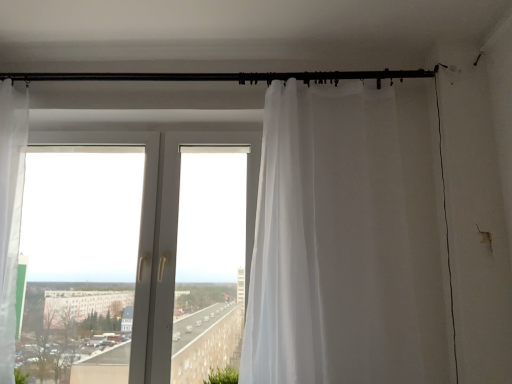
The width and height of the screenshot is (512, 384). In order to click on green leafy plant at lower left in this screenshot , I will do `click(21, 376)`.

Where is `transparent plastic window at center`? The image size is (512, 384). transparent plastic window at center is located at coordinates (159, 214).

From a real-world perspective, is black metal rod at upper center on top of transparent plastic window at center?

Yes.

Locate an element on the screen. The width and height of the screenshot is (512, 384). window that is in front of the black metal rod at upper center is located at coordinates (159, 214).

Does black metal rod at upper center appear on the right side of transparent plastic window at center?

Correct, you'll find black metal rod at upper center to the right of transparent plastic window at center.

Does point (105, 80) appear closer or farther from the camera than point (152, 221)?

Point (105, 80) appears to be farther away from the viewer than point (152, 221).

Considering the relative positions of sheer white curtain at right and transparent plastic window at center in the image provided, is sheer white curtain at right behind transparent plastic window at center?

No, sheer white curtain at right is closer to the viewer.

Does point (356, 269) appear closer or farther from the camera than point (148, 150)?

Point (356, 269) is positioned closer to the camera compared to point (148, 150).

Between sheer white curtain at right and transparent plastic window at center, which one has larger width?

sheer white curtain at right is wider.

The width and height of the screenshot is (512, 384). What are the coordinates of `window behind the sheer white curtain at right` in the screenshot? It's located at (159, 214).

From the image's perspective, would you say black metal rod at upper center is shown under green leafy plant at lower left?

No, from the image's perspective, black metal rod at upper center is not below green leafy plant at lower left.

In the scene shown: Can you tell me how much black metal rod at upper center and green leafy plant at lower left differ in facing direction?

There is a 0.255-degree angle between the facing directions of black metal rod at upper center and green leafy plant at lower left.

Is black metal rod at upper center touching green leafy plant at lower left?

No, black metal rod at upper center is not beside green leafy plant at lower left.

Can you confirm if black metal rod at upper center is positioned to the left of green leafy plant at lower left?

Incorrect, black metal rod at upper center is not on the left side of green leafy plant at lower left.

Identify the location of window behind the green leafy plant at lower left. Image resolution: width=512 pixels, height=384 pixels. (159, 214).

Considering the sizes of transparent plastic window at center and green leafy plant at lower left in the image, is transparent plastic window at center bigger or smaller than green leafy plant at lower left?

Considering their sizes, transparent plastic window at center takes up more space than green leafy plant at lower left.

From the image's perspective, does transparent plastic window at center appear higher than green leafy plant at lower left?

Yes.

Is green leafy plant at lower left at the back of transparent plastic window at center?

No, transparent plastic window at center is not facing away from green leafy plant at lower left.

Can you tell me how much transparent plastic window at center and sheer white curtain at right differ in facing direction?

0.876 degrees separate the facing orientations of transparent plastic window at center and sheer white curtain at right.

In the image, is transparent plastic window at center positioned in front of or behind sheer white curtain at right?

In the image, transparent plastic window at center appears behind sheer white curtain at right.

Looking at this image, does transparent plastic window at center contain sheer white curtain at right?

No, transparent plastic window at center does not contain sheer white curtain at right.

Is the surface of transparent plastic window at center in direct contact with sheer white curtain at right?

No, transparent plastic window at center is not touching sheer white curtain at right.

Can you confirm if black metal rod at upper center is positioned to the left of sheer white curtain at right?

Indeed, black metal rod at upper center is positioned on the left side of sheer white curtain at right.

Is black metal rod at upper center wider or thinner than sheer white curtain at right?

black metal rod at upper center is thinner than sheer white curtain at right.

Which object is further away from the camera, black metal rod at upper center or sheer white curtain at right?

black metal rod at upper center is behind.

Which of these two, black metal rod at upper center or sheer white curtain at right, stands taller?

With more height is sheer white curtain at right.

Measure the distance between transparent plastic window at center and black metal rod at upper center.

transparent plastic window at center is 24.30 inches from black metal rod at upper center.

In the scene shown: Is transparent plastic window at center placed right next to black metal rod at upper center?

transparent plastic window at center and black metal rod at upper center are not in contact.

Does point (152, 167) lie in front of point (270, 78)?

No.

The image size is (512, 384). In order to click on beam behind the transparent plastic window at center in this screenshot , I will do `click(230, 76)`.

Locate an element on the screen. window in front of the black metal rod at upper center is located at coordinates (159, 214).

Identify the location of curtain lying above the transparent plastic window at center (from the image's perspective). (331, 244).

From the image, which object appears to be farther from green leafy plant at lower left, transparent plastic window at center or sheer white curtain at right?

The object further to green leafy plant at lower left is sheer white curtain at right.

Based on their spatial positions, is sheer white curtain at right or green leafy plant at lower left further from transparent plastic window at center?

green leafy plant at lower left lies further to transparent plastic window at center than the other object.

When comparing their distances from sheer white curtain at right, does black metal rod at upper center or transparent plastic window at center seem further?

black metal rod at upper center is positioned further to the anchor sheer white curtain at right.

Based on their spatial positions, is transparent plastic window at center or black metal rod at upper center closer to green leafy plant at lower left?

transparent plastic window at center is positioned closer to the anchor green leafy plant at lower left.

Consider the image. Looking at the image, which one is located further to green leafy plant at lower left, sheer white curtain at right or black metal rod at upper center?

The object further to green leafy plant at lower left is black metal rod at upper center.

Looking at the image, which one is located closer to transparent plastic window at center, black metal rod at upper center or green leafy plant at lower left?

The object closer to transparent plastic window at center is black metal rod at upper center.

Based on their spatial positions, is black metal rod at upper center or sheer white curtain at right closer to transparent plastic window at center?

sheer white curtain at right is positioned closer to the anchor transparent plastic window at center.

From the picture: Which object lies further to the anchor point green leafy plant at lower left, sheer white curtain at right or transparent plastic window at center?

sheer white curtain at right is positioned further to the anchor green leafy plant at lower left.

This screenshot has height=384, width=512. I want to click on beam between transparent plastic window at center and sheer white curtain at right from left to right, so click(x=230, y=76).

Locate an element on the screen. The width and height of the screenshot is (512, 384). window between green leafy plant at lower left and sheer white curtain at right in the horizontal direction is located at coordinates [x=159, y=214].

Identify the location of window that lies between black metal rod at upper center and green leafy plant at lower left from top to bottom. The width and height of the screenshot is (512, 384). (159, 214).

This screenshot has width=512, height=384. Find the location of `curtain that lies between black metal rod at upper center and green leafy plant at lower left from top to bottom`. curtain that lies between black metal rod at upper center and green leafy plant at lower left from top to bottom is located at coordinates (331, 244).